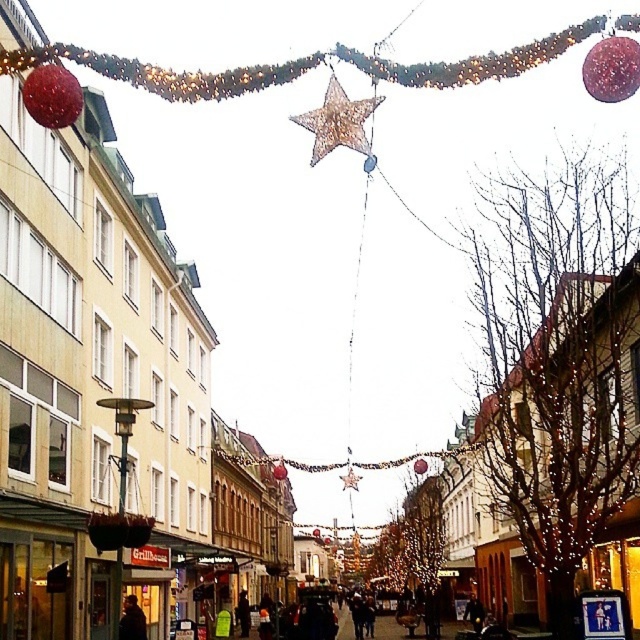
You are standing on the festive street and notice a glittery gold star at center. If you want to reach the star, should you walk towards the left side or the right side of the street?

The glittery gold star at center is located at point (337, 122), which is closer to the left side of the street. Therefore, you should walk towards the left side to reach it.

You are a delivery drone flying over a festive street scene. You need to deliver a package to a location between the glittery gold star at center and the metallic gold star at center. What is the minimum distance you must cover to reach the delivery point?

The glittery gold star at center and metallic gold star at center are 145.98 meters apart. The minimum distance to reach the delivery point between them would be half of that distance, so approximately 72.99 meters.